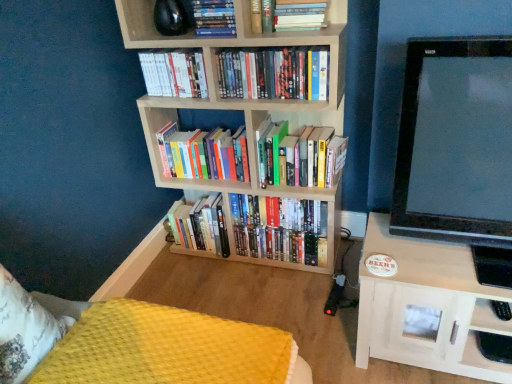
Find the location of `vacant area on top of hardcover books at center, the fifth book when ordered from bottom to top (from a real-world perspective)`. vacant area on top of hardcover books at center, the fifth book when ordered from bottom to top (from a real-world perspective) is located at coordinates (271, 48).